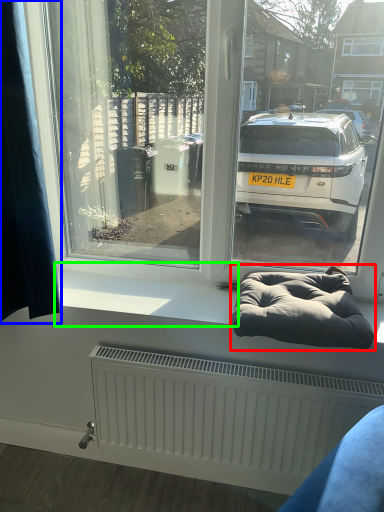
Question: Considering the real-world distances, which object is closest to bean bag chair (highlighted by a red box)? curtain (highlighted by a blue box) or window sill (highlighted by a green box).

Choices:
 (A) curtain
 (B) window sill

Answer: (B)